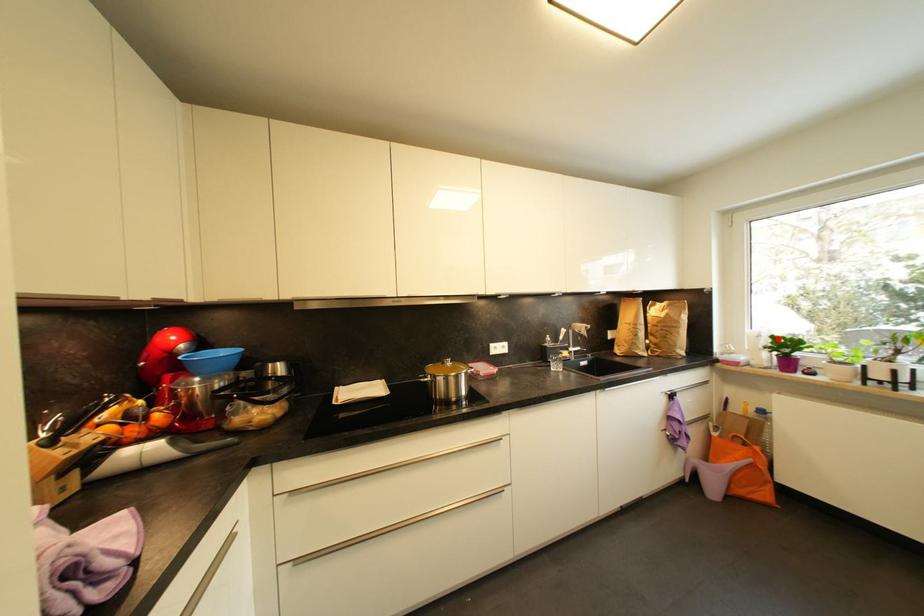
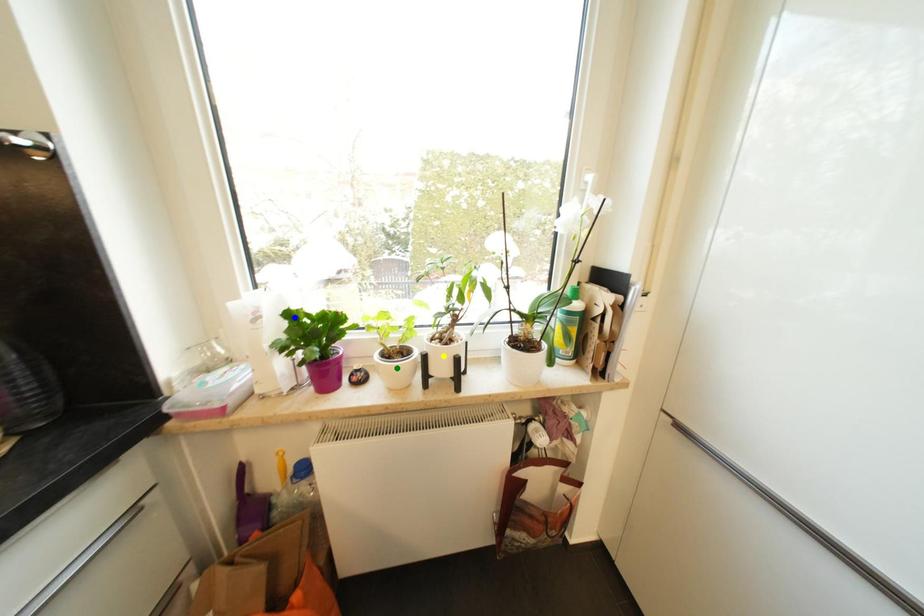
Question: I am providing you with two images of the same scene from different viewpoints. A red point is marked on the first image. You are given multiple points on the second image. Can you choose the point in image 2 that corresponds to the point in image 1?

Choices:
 (A) yellow point
 (B) blue point
 (C) green point

Answer: (B)